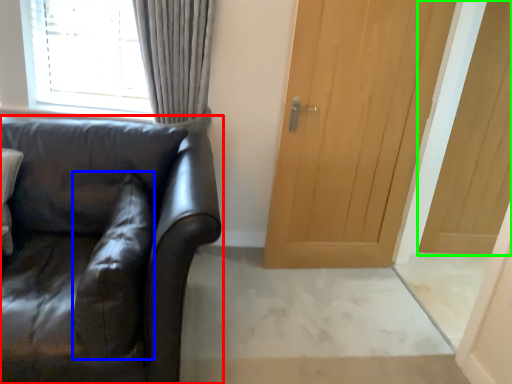
Question: Based on their relative distances, which object is farther from studio couch (highlighted by a red box)? Choose from pillow (highlighted by a blue box) and door (highlighted by a green box).

Choices:
 (A) pillow
 (B) door

Answer: (B)